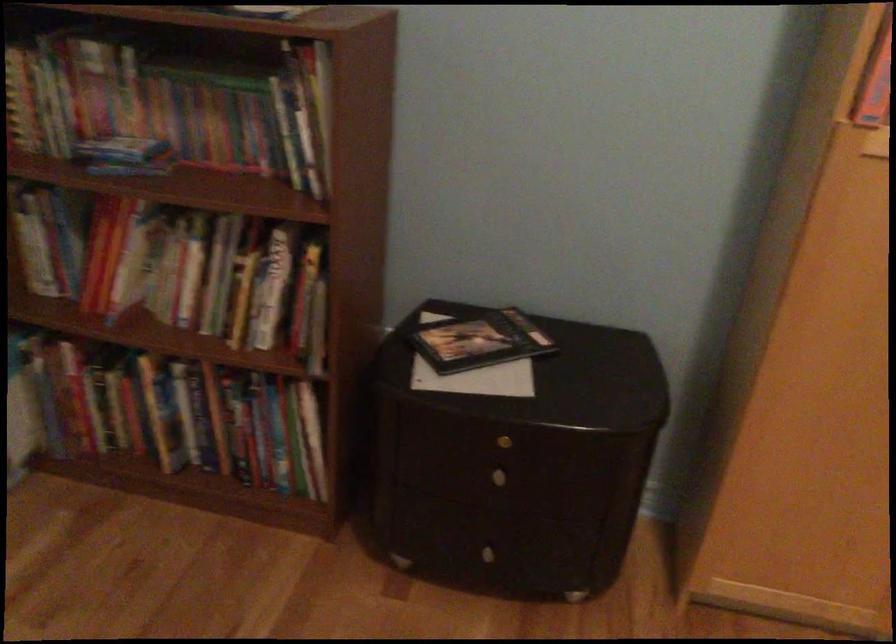
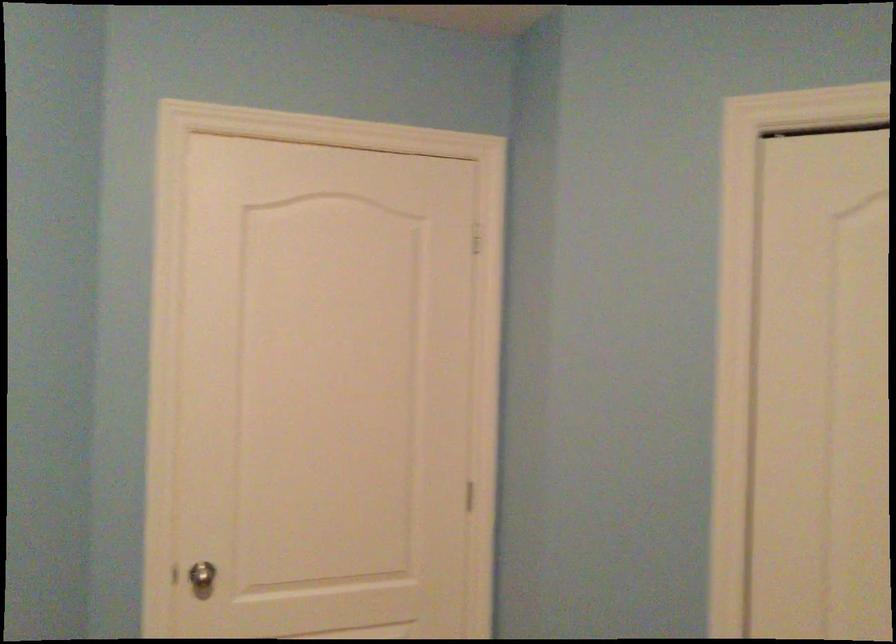
Question: Based on the continuous images, in which direction is the camera rotating? Reply with the corresponding letter.

Choices:
 (A) Left
 (B) Right
 (C) Up
 (D) Down

Answer: (A)